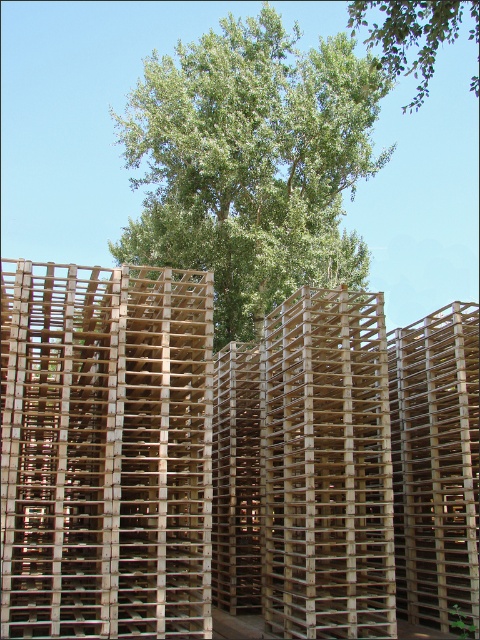
Question: Can you confirm if natural wood pallets at center is wider than green leafy tree at upper center?

Choices:
 (A) no
 (B) yes

Answer: (A)

Question: Which is farther from the green leafy tree at upper center?

Choices:
 (A) natural wood pallets at center
 (B) green leafy tree at center

Answer: (A)

Question: Where is green leafy tree at center located in relation to green leafy tree at upper center in the image?

Choices:
 (A) left
 (B) right

Answer: (A)

Question: Which point is farther from the camera taking this photo?

Choices:
 (A) (276, 236)
 (B) (392, 4)

Answer: (A)

Question: Which of these objects is positioned farthest from the green leafy tree at center?

Choices:
 (A) green leafy tree at upper center
 (B) natural wood pallets at center

Answer: (B)

Question: Is natural wood pallets at center to the left of green leafy tree at center from the viewer's perspective?

Choices:
 (A) no
 (B) yes

Answer: (A)